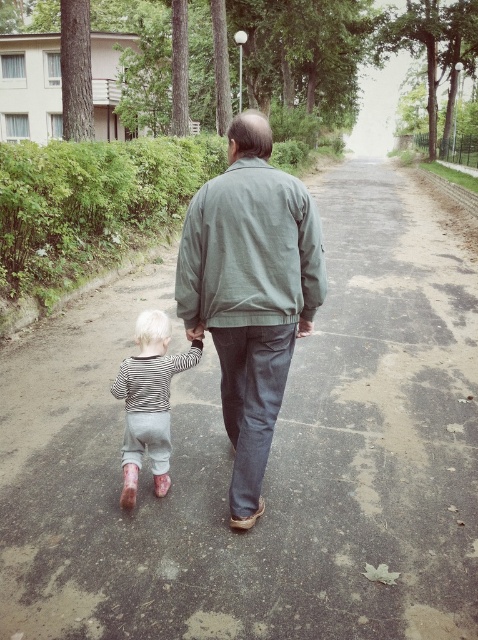
Does gray cotton jacket at center have a greater width compared to striped cotton shirt at lower left?

Correct, the width of gray cotton jacket at center exceeds that of striped cotton shirt at lower left.

Who is higher up, gray cotton jacket at center or striped cotton shirt at lower left?

Positioned higher is gray cotton jacket at center.

Does point (225, 304) come farther from viewer compared to point (151, 348)?

No, (225, 304) is in front of (151, 348).

I want to click on gray cotton jacket at center, so click(249, 292).